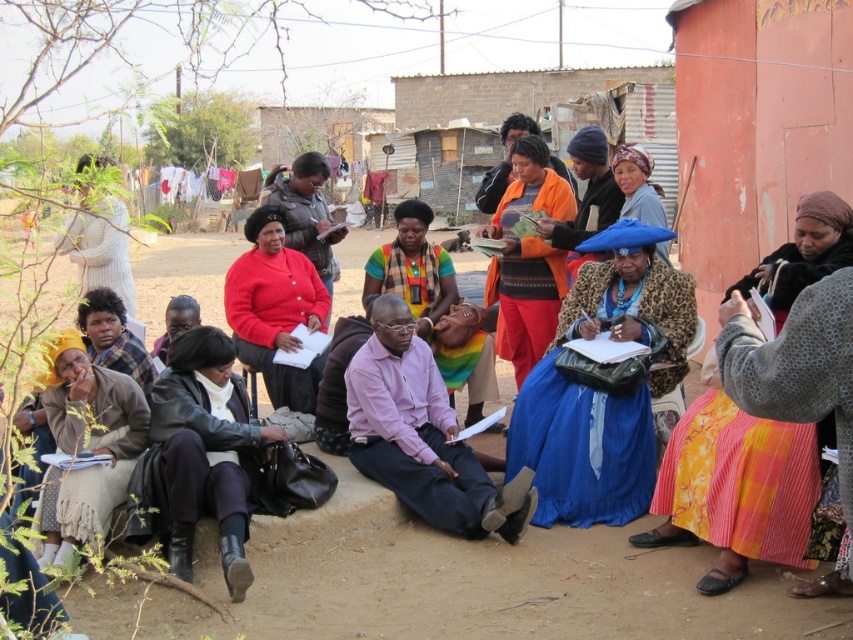
You are a photographer trying to capture a photo of the blue leopard print coat at center and the orange fabric at center. Which object should you focus on first if you want to include both in your frame without moving the camera?

You should focus on the blue leopard print coat at center first because it is shorter than the orange fabric at center, allowing both to fit within the frame more easily.

You are organizing a photo shoot and need to place a 1.2 meter wide backdrop. You have two options available on site, the blue leopard print coat at center and the orange fabric at center. Which one would you choose to ensure it is wide enough?

The blue leopard print coat at center is wider than the orange fabric at center, so you should choose the blue leopard print coat at center as it is wider and more likely to meet the 1.2 meter requirement.